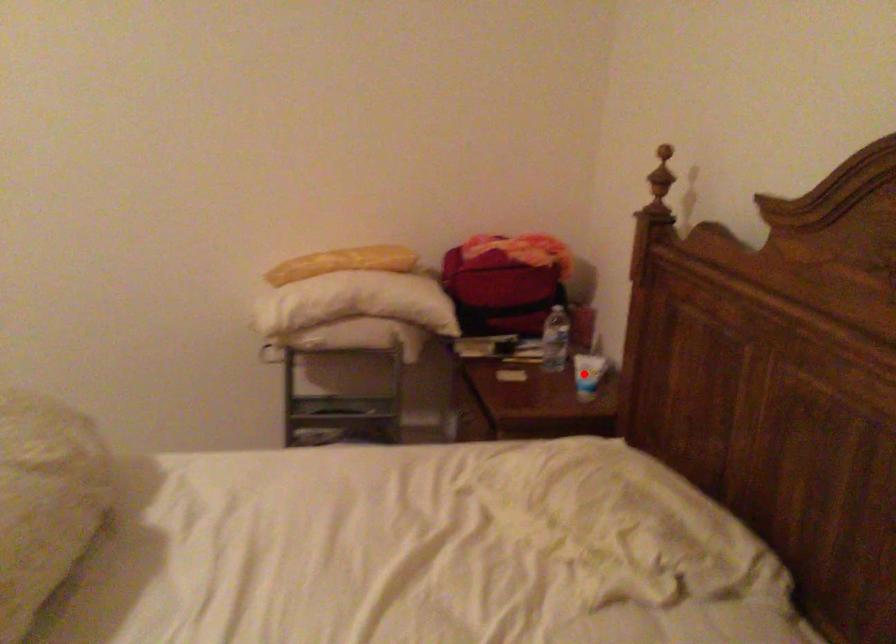
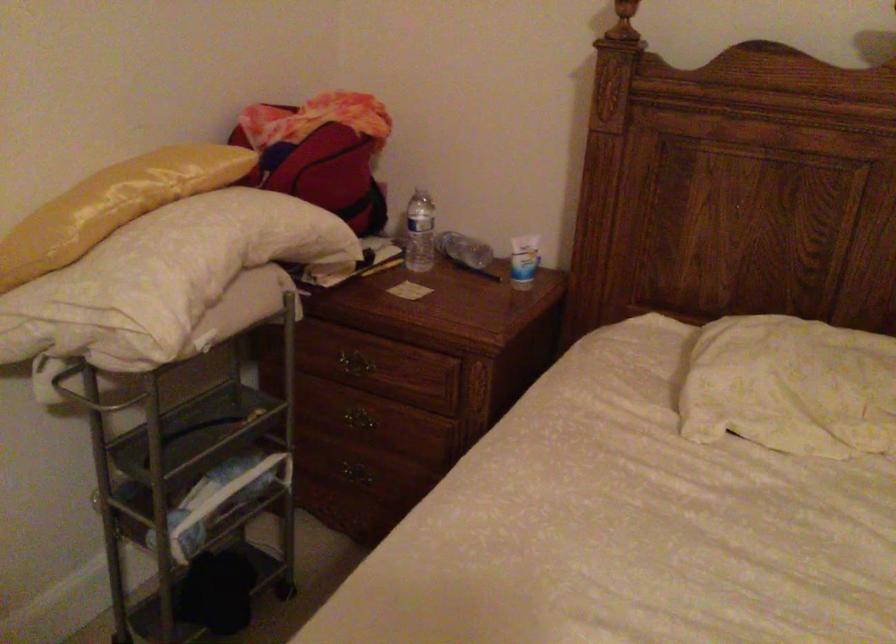
Question: I am providing you with two images of the same scene from different viewpoints. Given a red point in image1, look at the same physical point in image2. Is it:

Choices:
 (A) Closer to the viewpoint
 (B) Farther from the viewpoint

Answer: (A)